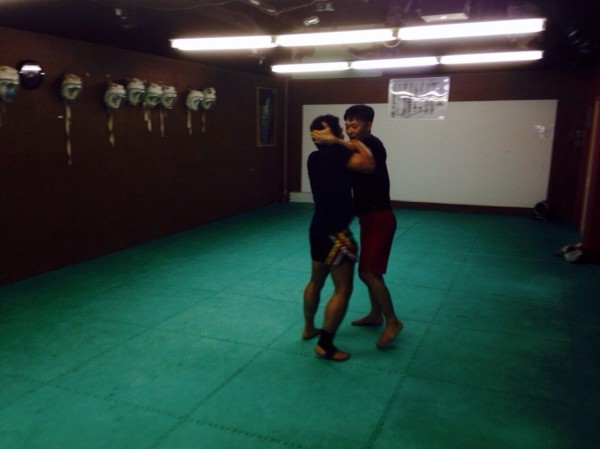
Where is `wall`? wall is located at coordinates (471, 164), (132, 180).